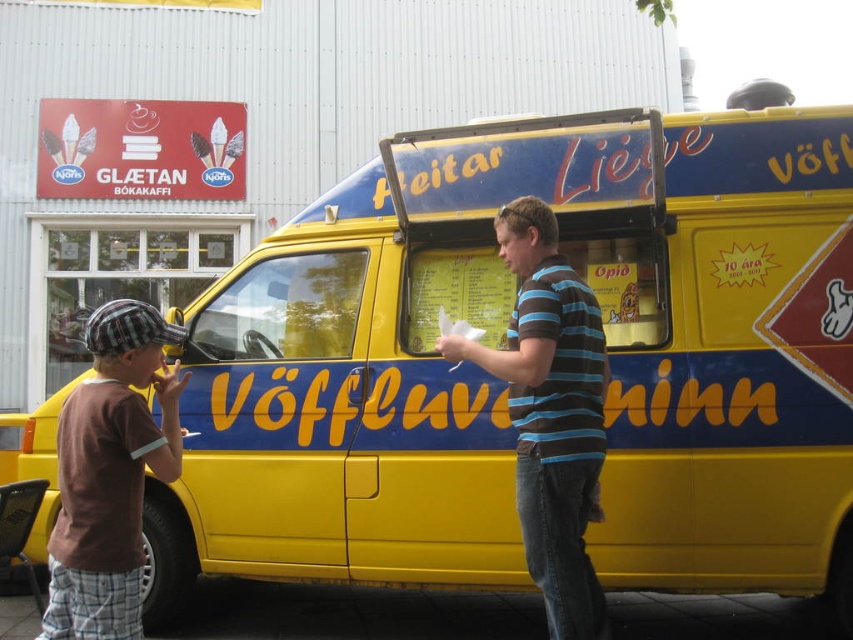
Consider the image. Is striped cotton shirt at center in front of brown cotton shirt at left?

That is False.

Measure the distance between striped cotton shirt at center and camera.

They are 3.23 meters apart.

The image size is (853, 640). I want to click on striped cotton shirt at center, so click(550, 413).